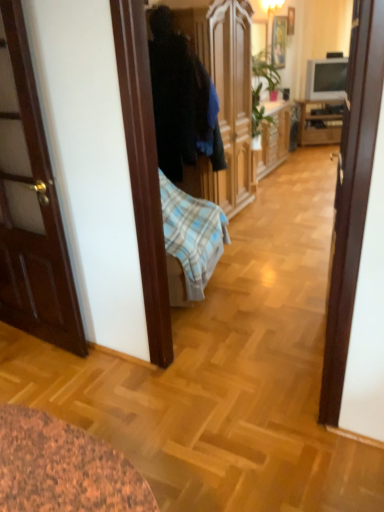
Question: Does wooden cabinet at right have a smaller size compared to matte white lampshade at upper center?

Choices:
 (A) yes
 (B) no

Answer: (B)

Question: Is wooden cabinet at right outside matte white lampshade at upper center?

Choices:
 (A) no
 (B) yes

Answer: (B)

Question: Is matte white lampshade at upper center located within wooden cabinet at right?

Choices:
 (A) yes
 (B) no

Answer: (B)

Question: Is wooden cabinet at right taller than matte white lampshade at upper center?

Choices:
 (A) no
 (B) yes

Answer: (B)

Question: Is wooden cabinet at right wider than matte white lampshade at upper center?

Choices:
 (A) no
 (B) yes

Answer: (B)

Question: From the image's perspective, is wooden cabinet at right located beneath matte white lampshade at upper center?

Choices:
 (A) no
 (B) yes

Answer: (B)

Question: Is wooden cabinet at right inside matte gray tv at upper right?

Choices:
 (A) no
 (B) yes

Answer: (A)

Question: Considering the relative sizes of matte gray tv at upper right and wooden cabinet at right in the image provided, is matte gray tv at upper right bigger than wooden cabinet at right?

Choices:
 (A) yes
 (B) no

Answer: (B)

Question: From the image's perspective, is matte gray tv at upper right beneath wooden cabinet at right?

Choices:
 (A) yes
 (B) no

Answer: (B)

Question: From a real-world perspective, is matte gray tv at upper right physically below wooden cabinet at right?

Choices:
 (A) no
 (B) yes

Answer: (A)

Question: From the image's perspective, is matte gray tv at upper right on top of wooden cabinet at right?

Choices:
 (A) yes
 (B) no

Answer: (A)

Question: Can you confirm if matte gray tv at upper right is shorter than wooden cabinet at right?

Choices:
 (A) yes
 (B) no

Answer: (A)

Question: Is wooden picture frame at upper center, which is counted as the 1th picture frame, starting from the right, next to wooden picture frame at upper center, which ranks as the second picture frame in right-to-left order?

Choices:
 (A) yes
 (B) no

Answer: (B)